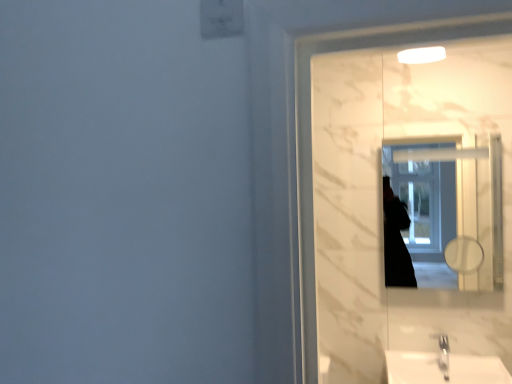
Identify the location of empty space that is ontop of white glossy sink at lower right (from a real-world perspective). (435, 356).